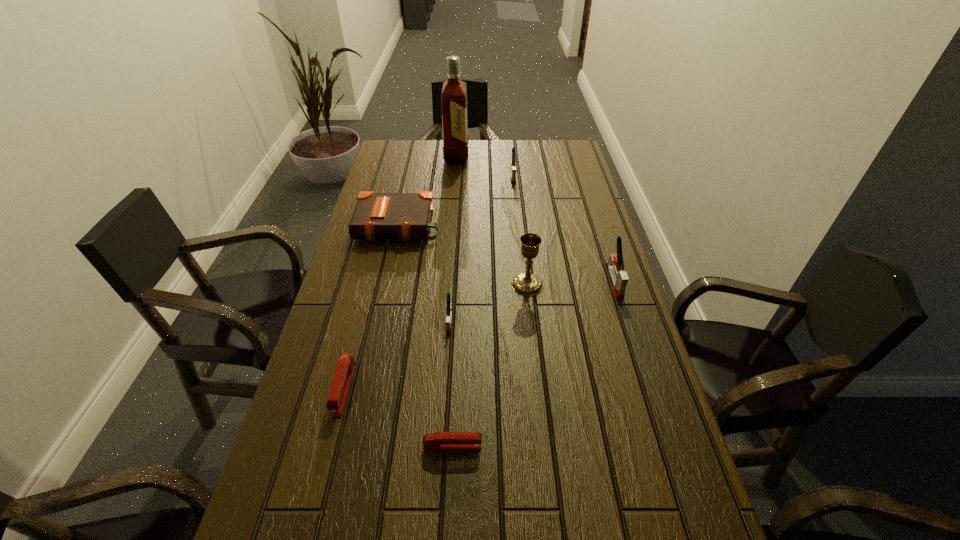
I want to click on stapler that is the fifth closest to the third farthest object, so click(x=441, y=441).

At what (x,y) coordinates should I click in order to perform the action: click on stapler that stands as the second closest to the right red stapler. Please return your answer as a coordinate pair (x, y). Looking at the image, I should click on (449, 306).

Locate which gray stapler is the closest to the rightmost object. Please provide its 2D coordinates. Your answer should be formatted as a tuple, i.e. [(x, y)], where the tuple contains the x and y coordinates of a point satisfying the conditions above.

[(449, 306)]

I want to click on the closest gray stapler relative to the Bible, so click(x=449, y=306).

Choose which red stapler is the nearest neighbor to the second tallest object. Please provide its 2D coordinates. Your answer should be formatted as a tuple, i.e. [(x, y)], where the tuple contains the x and y coordinates of a point satisfying the conditions above.

[(441, 441)]

Find the location of a particular element. the closest red stapler relative to the Bible is located at coordinates (339, 389).